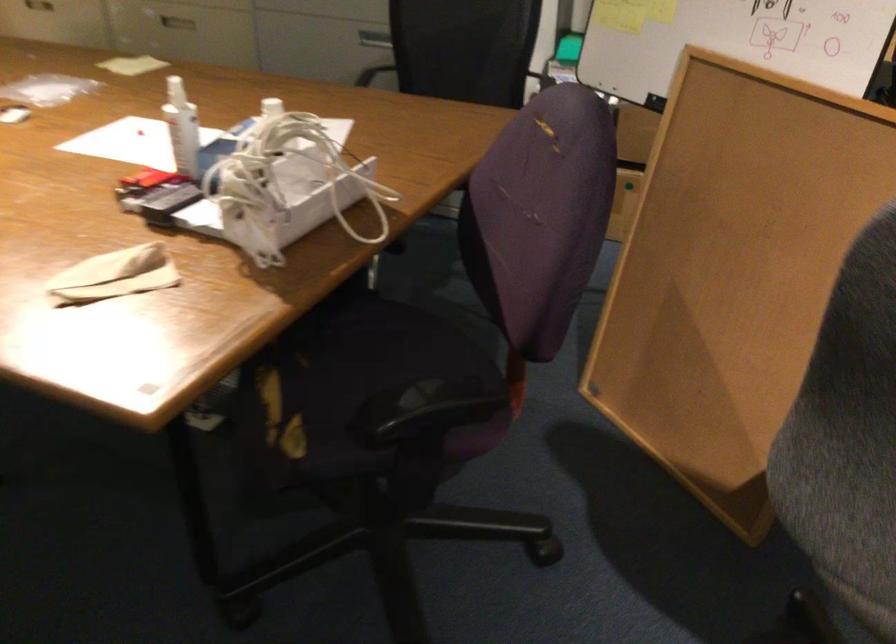
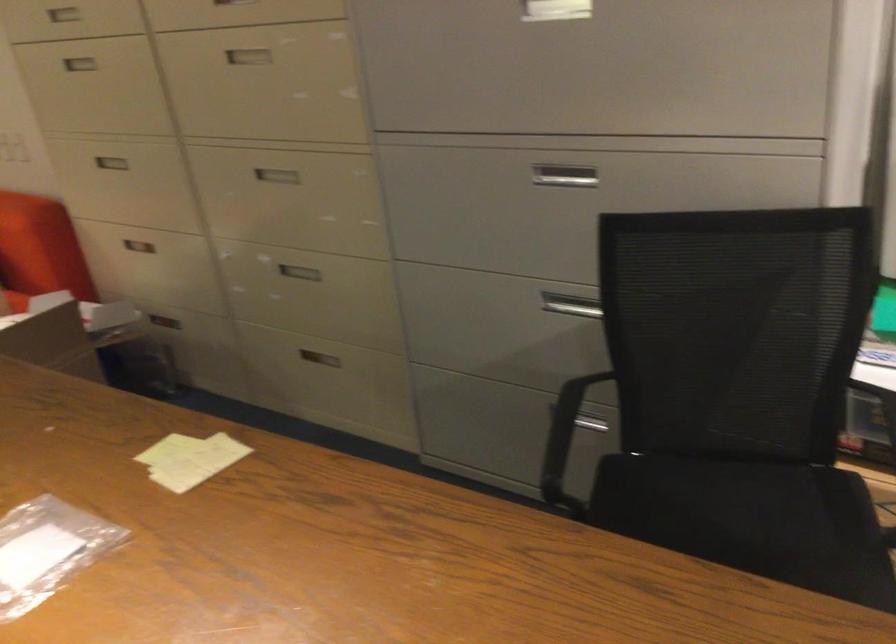
Where in the second image is the point corresponding to [130,69] from the first image?

(190, 459)